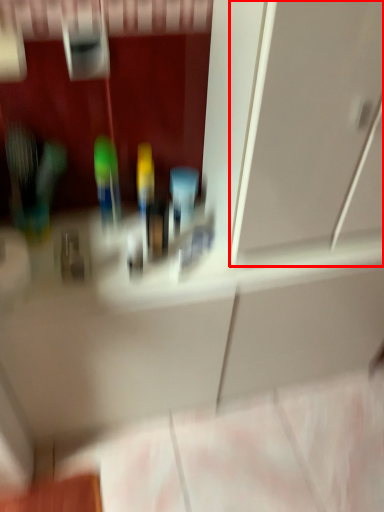
Question: From the image, what is the correct spatial relationship of glass door (annotated by the red box) in relation to toiletry?

Choices:
 (A) left
 (B) right

Answer: (B)